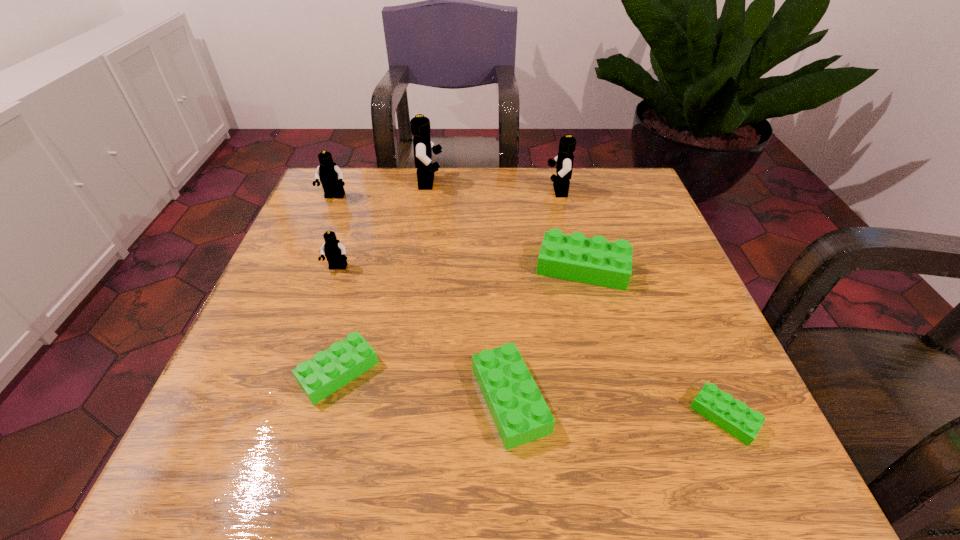
The image size is (960, 540). Find the location of `blank space at the right edge of the desktop`. blank space at the right edge of the desktop is located at coordinates (685, 327).

In the image, there is a desktop. In order to click on free space at the far right corner in this screenshot , I will do `click(600, 174)`.

I want to click on free spot between the fifth tallest object and the fourth object from left to right, so click(x=506, y=225).

This screenshot has height=540, width=960. In order to click on free spot between the biggest green Lego and the biggest black Lego in this screenshot , I will do `click(506, 225)`.

Where is `free space that is in between the third black Lego from left to right and the leftmost object`? free space that is in between the third black Lego from left to right and the leftmost object is located at coordinates (382, 190).

Where is `free spot between the tallest Lego and the second tallest object`? This screenshot has height=540, width=960. free spot between the tallest Lego and the second tallest object is located at coordinates (493, 187).

Identify the location of vacant space that is in between the seventh tallest Lego and the seventh shortest Lego. This screenshot has height=540, width=960. (448, 281).

Locate an element on the screen. vacant area that lies between the seventh tallest Lego and the sixth shortest object is located at coordinates (336, 285).

Where is `vacant region between the second shortest Lego and the fifth shortest Lego`? vacant region between the second shortest Lego and the fifth shortest Lego is located at coordinates (338, 320).

Locate an element on the screen. vacant space that is in between the nearest black Lego and the rightmost black Lego is located at coordinates (447, 230).